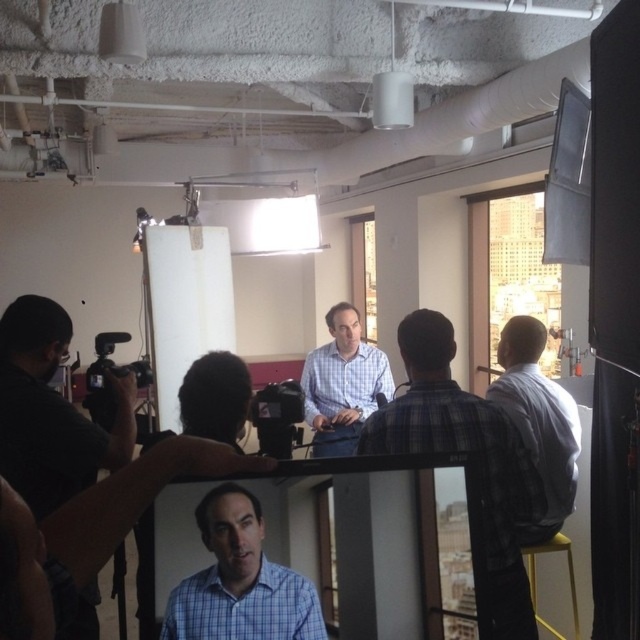
Who is positioned more to the left, blue checkered shirt at center or checkered shirt at center?

Positioned to the left is blue checkered shirt at center.

Is blue checkered shirt at center above checkered shirt at center?

Incorrect, blue checkered shirt at center is not positioned above checkered shirt at center.

Is point (243, 609) positioned before point (317, 376)?

Yes.

Locate an element on the screen. blue checkered shirt at center is located at coordinates (240, 580).

In order to click on blue checkered shirt at center in this screenshot , I will do `click(240, 580)`.

Between blue checkered shirt at center and white shirt at right, which one is positioned higher?

white shirt at right

The height and width of the screenshot is (640, 640). Identify the location of blue checkered shirt at center. (240, 580).

The image size is (640, 640). What are the coordinates of `blue checkered shirt at center` in the screenshot? It's located at (240, 580).

Between checkered shirt at center and black plastic video camera at center, which one is positioned higher?

black plastic video camera at center is higher up.

Measure the distance between checkered shirt at center and camera.

checkered shirt at center and camera are 10.67 feet apart.

Where is `checkered shirt at center`? The height and width of the screenshot is (640, 640). checkered shirt at center is located at coordinates (342, 385).